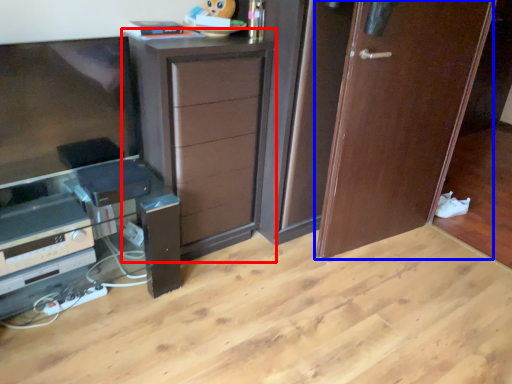
Question: Which point is closer to the camera, chest of drawers (highlighted by a red box) or door (highlighted by a blue box)?

Choices:
 (A) chest of drawers
 (B) door

Answer: (A)